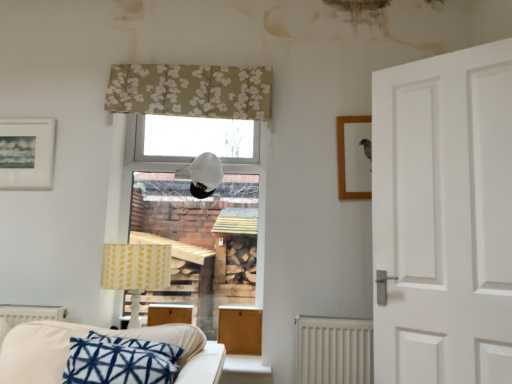
This screenshot has height=384, width=512. Identify the location of empty space that is ontop of beige floral fabric at upper center (from a real-world perspective). (194, 64).